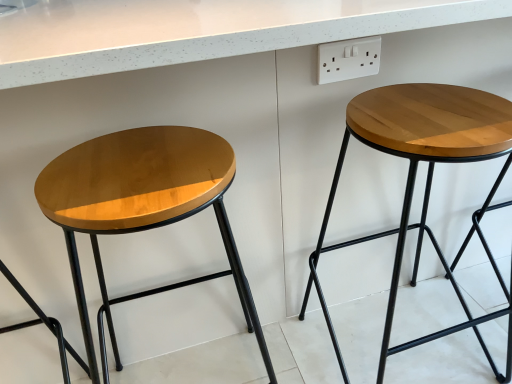
Question: Is point (364, 43) positioned closer to the camera than point (101, 190)?

Choices:
 (A) farther
 (B) closer

Answer: (A)

Question: Is white plastic socket at upper right in front of or behind glossy wood stool at left, positioned as the second stool in right-to-left order, in the image?

Choices:
 (A) front
 (B) behind

Answer: (B)

Question: Based on their relative distances, which object is farther from the white plastic socket at upper right?

Choices:
 (A) glossy wood stool at left, positioned as the second stool in right-to-left order
 (B) wooden stool at right, which is the first stool from right to left

Answer: (A)

Question: Based on their relative distances, which object is farther from the wooden stool at right, which is the first stool from right to left?

Choices:
 (A) glossy wood stool at left, positioned as the second stool in right-to-left order
 (B) white plastic socket at upper right

Answer: (A)